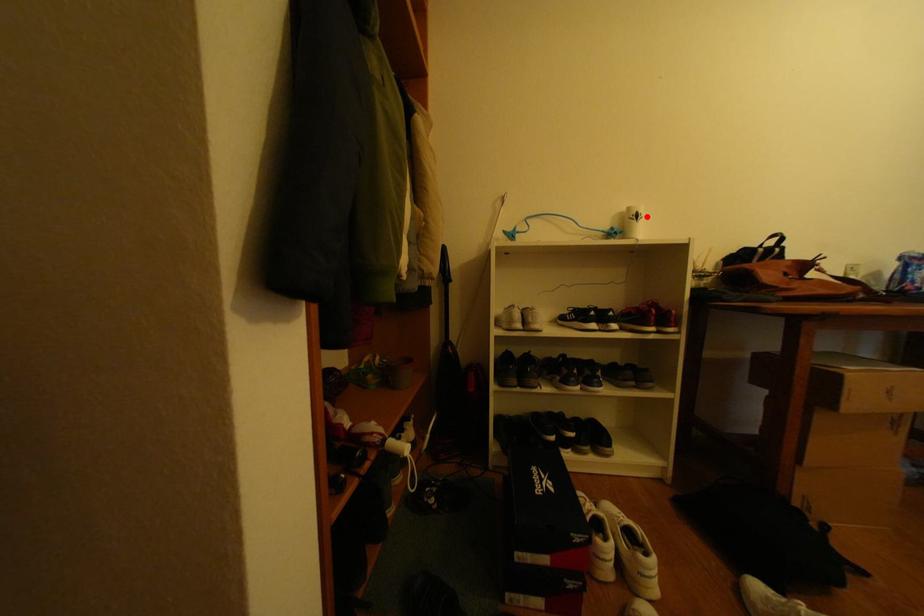
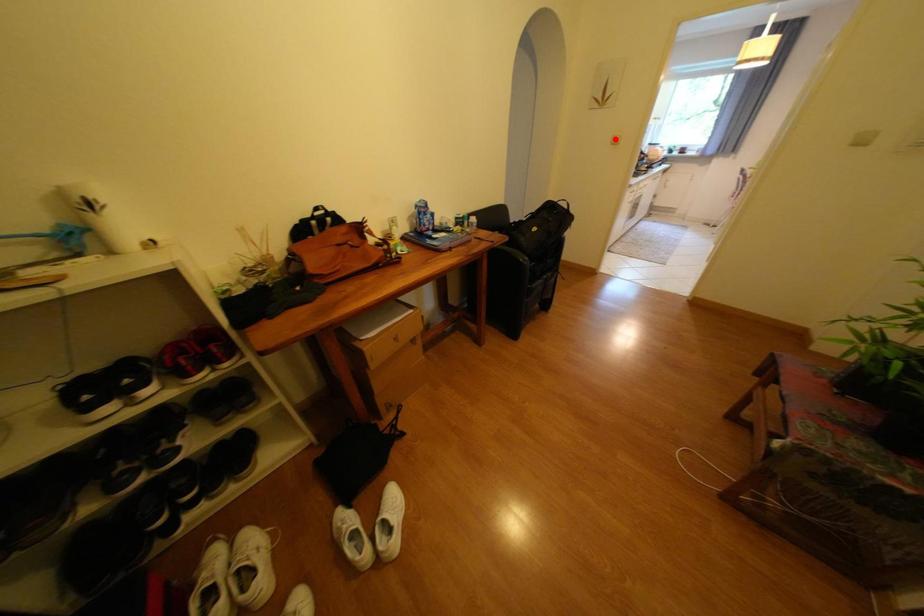
I am providing you with two images of the same scene from different viewpoints. A red point is marked on the first image and another point is marked on the second image. Do the highlighted points in image1 and image2 indicate the same real-world spot?

No